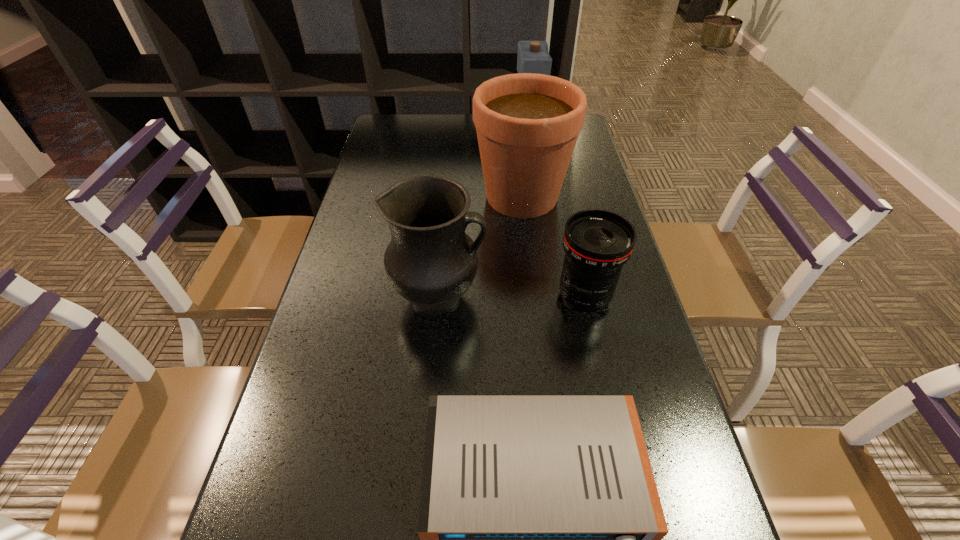
Image resolution: width=960 pixels, height=540 pixels. Identify the location of mallet that is positioned at the right edge. (533, 56).

I want to click on telephoto lens positioned at the right edge, so click(597, 243).

Find the location of `object that is positioned at the far right corner`. object that is positioned at the far right corner is located at coordinates (533, 56).

In the image, there is a desktop. Where is `blank space at the far edge`? This screenshot has width=960, height=540. blank space at the far edge is located at coordinates (436, 123).

In the image, there is a desktop. Where is `vacant space at the left edge`? vacant space at the left edge is located at coordinates (398, 173).

The image size is (960, 540). I want to click on vacant space at the right edge, so click(x=576, y=148).

Where is `free location at the far left corner`? This screenshot has width=960, height=540. free location at the far left corner is located at coordinates (395, 131).

Locate an element on the screen. This screenshot has width=960, height=540. vacant space in between the farthest object and the pitcher is located at coordinates tap(484, 214).

Find the location of a particular element. vacant region between the second shortest object and the second farthest object is located at coordinates (553, 246).

Find the location of a particular element. The height and width of the screenshot is (540, 960). vacant area that lies between the second shortest object and the flowerpot is located at coordinates (553, 246).